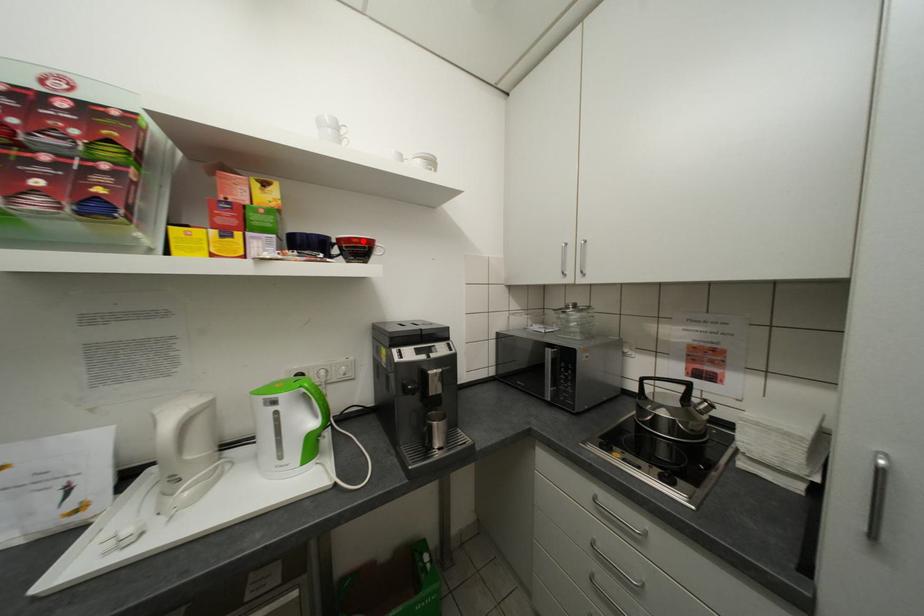
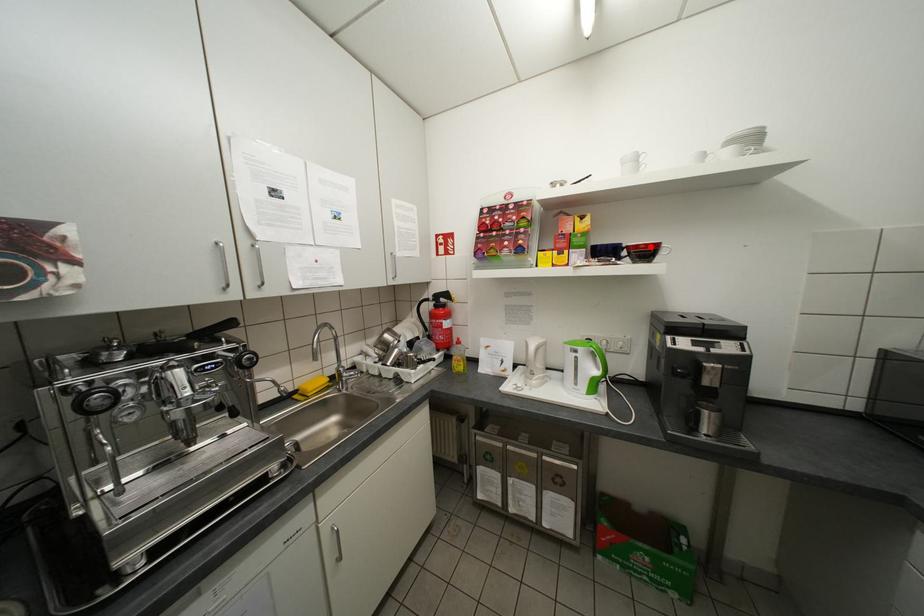
I am providing you with two images of the same scene from different viewpoints. A red point is marked on the first image and another point is marked on the second image. Are the points marked in image1 and image2 representing the same 3D position?

Yes